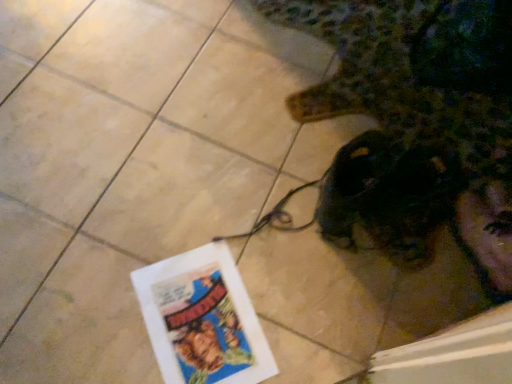
Image resolution: width=512 pixels, height=384 pixels. What are the coordinates of `free space between white paper flyer at lower left and shiny black headphones at lower right` in the screenshot? It's located at (290, 261).